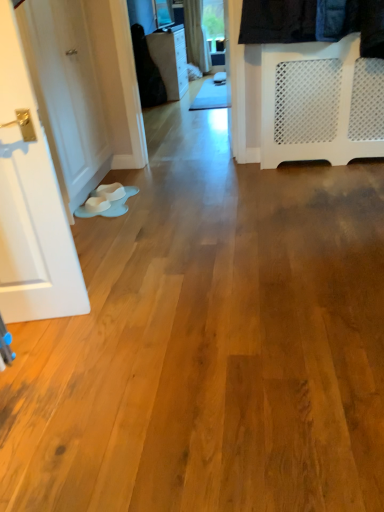
Question: From a real-world perspective, is black fabric at upper left over matte black dresser at upper center?

Choices:
 (A) yes
 (B) no

Answer: (A)

Question: Would you say black fabric at upper left is a long distance from matte black dresser at upper center?

Choices:
 (A) no
 (B) yes

Answer: (A)

Question: Is black fabric at upper left to the right of matte black dresser at upper center from the viewer's perspective?

Choices:
 (A) yes
 (B) no

Answer: (B)

Question: Is black fabric at upper left positioned beyond the bounds of matte black dresser at upper center?

Choices:
 (A) no
 (B) yes

Answer: (B)

Question: Is black fabric at upper left looking in the opposite direction of matte black dresser at upper center?

Choices:
 (A) no
 (B) yes

Answer: (A)

Question: Looking at their shapes, would you say matte black dresser at upper center is wider or thinner than black fabric at upper left?

Choices:
 (A) wide
 (B) thin

Answer: (A)

Question: From a real-world perspective, is matte black dresser at upper center above or below black fabric at upper left?

Choices:
 (A) below
 (B) above

Answer: (A)

Question: Is matte black dresser at upper center inside or outside of black fabric at upper left?

Choices:
 (A) inside
 (B) outside

Answer: (B)

Question: Considering the positions of point (178, 46) and point (145, 53), is point (178, 46) closer or farther from the camera than point (145, 53)?

Choices:
 (A) closer
 (B) farther

Answer: (B)

Question: From a real-world perspective, is black fabric at upper left positioned above or below white painted wood door at left?

Choices:
 (A) above
 (B) below

Answer: (B)

Question: Which is correct: black fabric at upper left is inside white painted wood door at left, or outside of it?

Choices:
 (A) outside
 (B) inside

Answer: (A)

Question: Considering the positions of black fabric at upper left and white painted wood door at left in the image, is black fabric at upper left taller or shorter than white painted wood door at left?

Choices:
 (A) short
 (B) tall

Answer: (A)

Question: Considering their positions, is black fabric at upper left located in front of or behind white painted wood door at left?

Choices:
 (A) behind
 (B) front

Answer: (A)

Question: Considering their positions, is white painted wood door at left located in front of or behind matte black dresser at upper center?

Choices:
 (A) front
 (B) behind

Answer: (A)

Question: From their relative heights in the image, would you say white painted wood door at left is taller or shorter than matte black dresser at upper center?

Choices:
 (A) tall
 (B) short

Answer: (A)